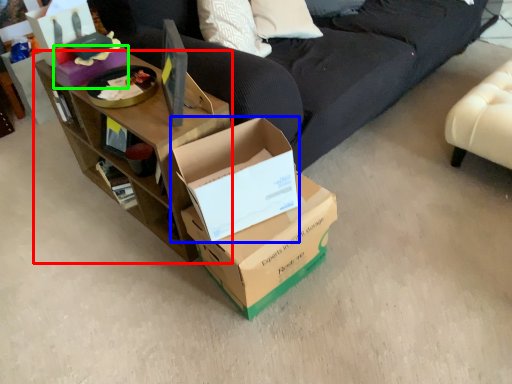
Question: Based on their relative distances, which object is nearer to shelf (highlighted by a red box)? Choose from box (highlighted by a blue box) and box (highlighted by a green box).

Choices:
 (A) box
 (B) box

Answer: (A)